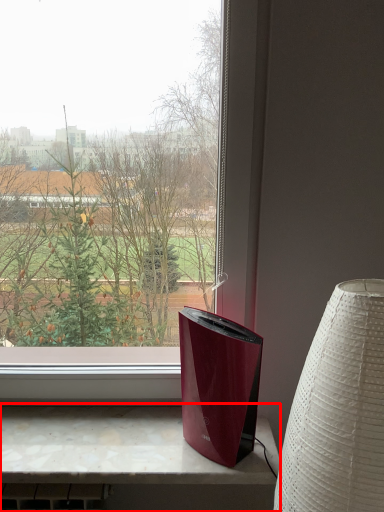
Question: Where is computer desk (annotated by the red box) located in relation to lamp in the image?

Choices:
 (A) left
 (B) right

Answer: (A)